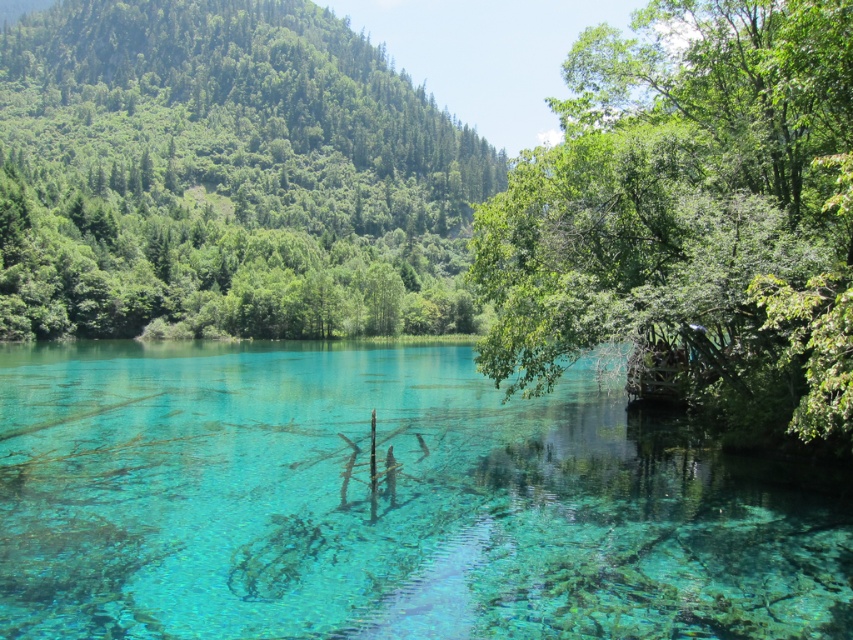
Consider the image. You are standing at the center of the lake and want to reach the nearest green leafy tree. Which tree should you head towards, the green leafy tree at upper left or the green leafy tree at right?

The green leafy tree at upper left is to the left of the green leafy tree at right, so you should head towards the green leafy tree at upper left as it is closer to your left side.

You are standing at the edge of the lake and want to take a photo of the green leafy tree at upper left without the transparent water at center blocking the view. Is this possible?

The transparent water at center is in front of the green leafy tree at upper left, so it will block the view. To capture the tree without the water obstructing it, you would need to position yourself where the water isn

Looking at this image, you are standing at the edge of the lake and notice the transparent water at center and the green leafy tree at right. Which object appears smaller in the scene?

The transparent water at center appears smaller than the green leafy tree at right in the scene.